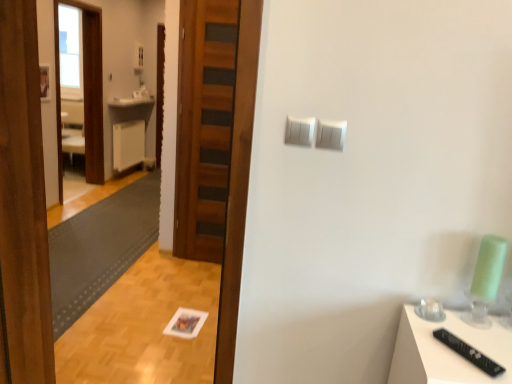
The height and width of the screenshot is (384, 512). I want to click on free space in front of wooden door at center, so click(x=192, y=266).